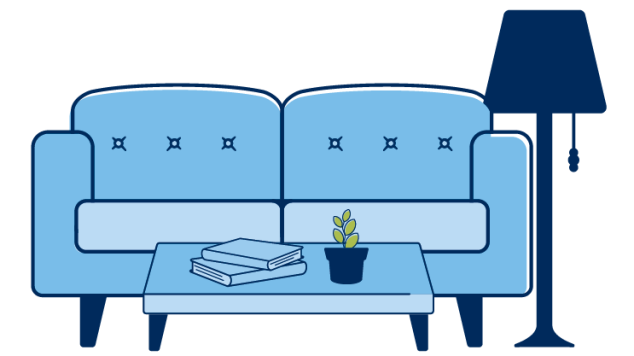
At what (x,y) coordinates should I click in order to perform the action: click on couch. Please return your answer as a coordinate pair (x, y). The width and height of the screenshot is (634, 356). Looking at the image, I should click on (228, 128).